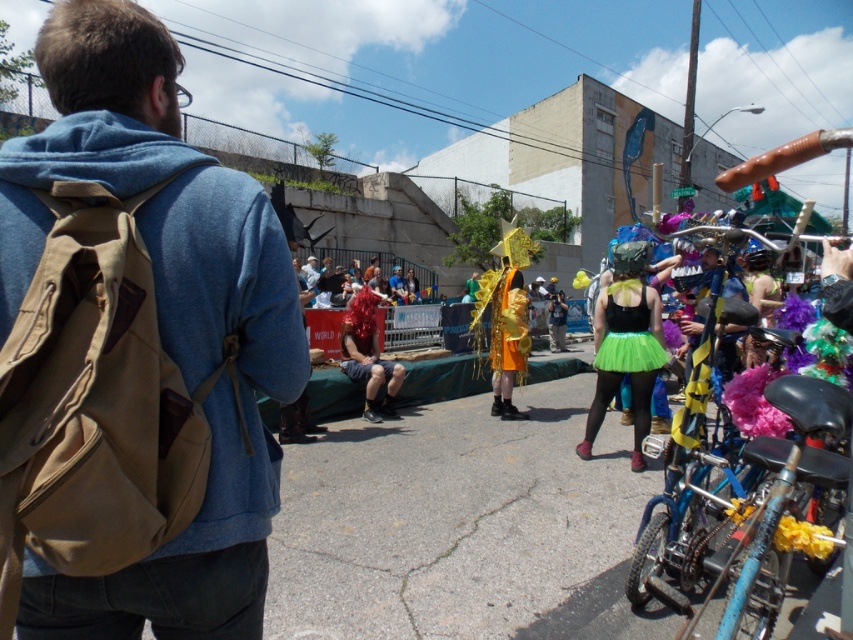
You are a photographer trying to capture the gold shiny costume at center and the green tulle skirt at center in the same frame. Based on their positions, which one should you focus on first to ensure both are in the frame?

The gold shiny costume at center is above the green tulle skirt at center. Therefore, you should focus on the gold shiny costume at center first to ensure both are in the frame since it is positioned higher up.

You are a photographer trying to capture the gold shiny costume at center and the green tulle skirt at center in the same frame. Based on their sizes, which one should you focus on to ensure both are visible without zooming in too much?

The gold shiny costume at center is much taller than the green tulle skirt at center, so focusing on the gold shiny costume at center would allow both to be visible without excessive zooming.